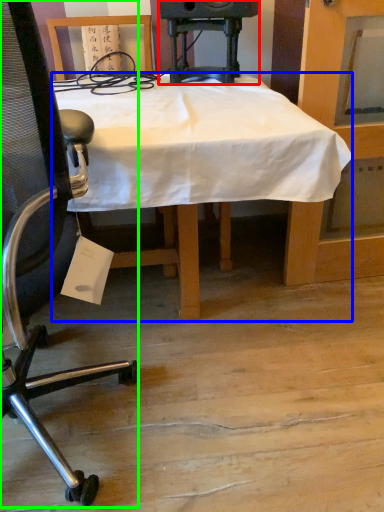
Question: Based on their relative distances, which object is farther from speaker (highlighted by a red box)? Choose from desk (highlighted by a blue box) and chair (highlighted by a green box).

Choices:
 (A) desk
 (B) chair

Answer: (B)